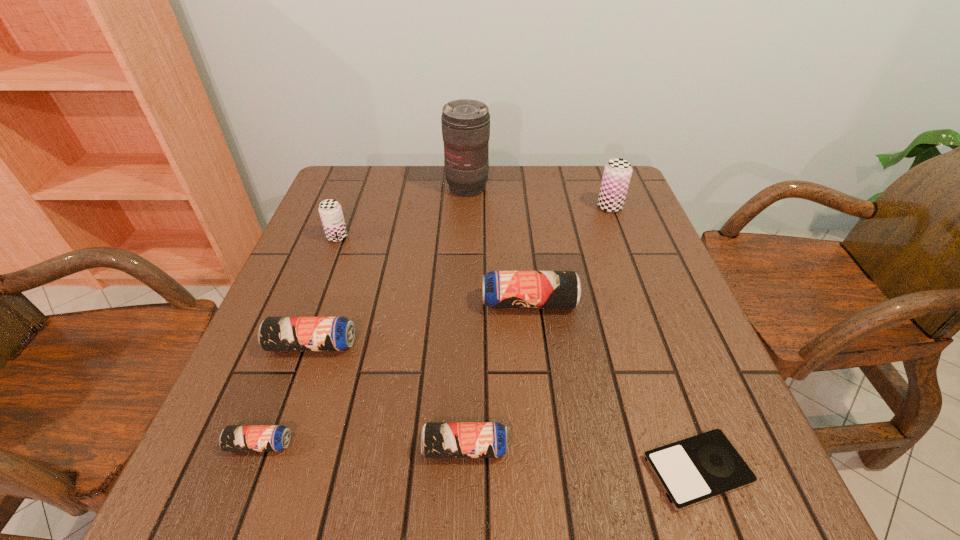
Find the location of a particular element. beer can object that ranks as the closest to the gray iPod is located at coordinates (438, 439).

Identify the location of beer can that stands as the sixth closest to the tallest object. The height and width of the screenshot is (540, 960). (233, 437).

The height and width of the screenshot is (540, 960). I want to click on the third closest blue beer can to the seventh tallest object, so click(501, 289).

This screenshot has height=540, width=960. I want to click on blue beer can that is the closest one to the gray iPod, so click(438, 439).

The height and width of the screenshot is (540, 960). Identify the location of free region that satisfies the following two spatial constraints: 1. on the back side of the bigger purple beer can; 2. on the left side of the fifth tallest object. (360, 207).

Where is `free space that satisfies the following two spatial constraints: 1. on the side of the telephoto lens where the control switches are located; 2. on the right side of the second shortest beer can`? The width and height of the screenshot is (960, 540). free space that satisfies the following two spatial constraints: 1. on the side of the telephoto lens where the control switches are located; 2. on the right side of the second shortest beer can is located at coordinates (457, 448).

The image size is (960, 540). Find the location of `blank area in the image that satisfies the following two spatial constraints: 1. on the side of the gray iPod where the control switches are located; 2. on the left side of the tallest object`. blank area in the image that satisfies the following two spatial constraints: 1. on the side of the gray iPod where the control switches are located; 2. on the left side of the tallest object is located at coordinates (456, 470).

Where is `free space that satisfies the following two spatial constraints: 1. on the back side of the right purple beer can; 2. on the right side of the shortest object`? The width and height of the screenshot is (960, 540). free space that satisfies the following two spatial constraints: 1. on the back side of the right purple beer can; 2. on the right side of the shortest object is located at coordinates (603, 207).